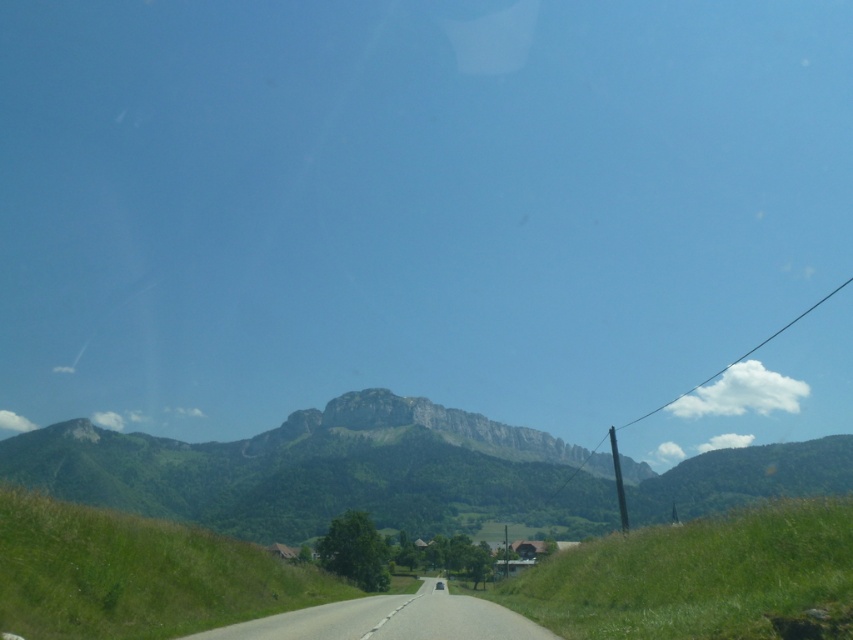
Does gray asphalt road at center appear on the right side of transparent glass car window at center?

Incorrect, gray asphalt road at center is not on the right side of transparent glass car window at center.

Between gray asphalt road at center and transparent glass car window at center, which one has less height?

Standing shorter between the two is transparent glass car window at center.

Is point (524, 628) positioned behind point (437, 580)?

No.

Image resolution: width=853 pixels, height=640 pixels. I want to click on gray asphalt road at center, so click(x=389, y=620).